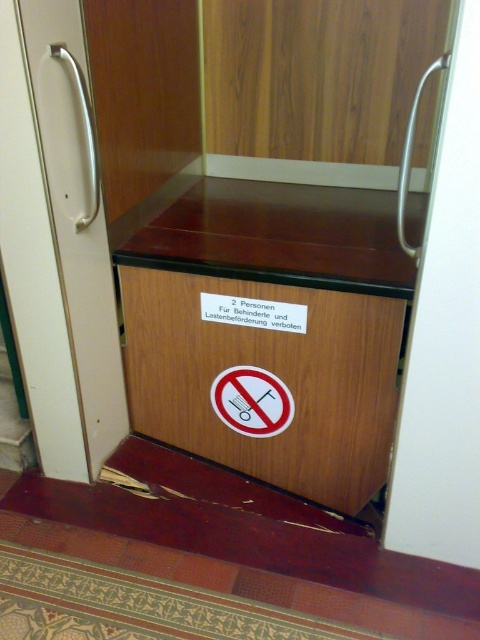
Question: Which point appears closest to the camera in this image?

Choices:
 (A) (349, 476)
 (B) (101, 228)

Answer: (B)

Question: Does wooden drawer at center have a greater width compared to white glossy door handle at left?

Choices:
 (A) yes
 (B) no

Answer: (A)

Question: Is wooden drawer at center behind white glossy door handle at left?

Choices:
 (A) yes
 (B) no

Answer: (A)

Question: Which object appears farthest from the camera in this image?

Choices:
 (A) wooden drawer at center
 (B) white glossy door handle at left

Answer: (A)

Question: Does wooden drawer at center have a smaller size compared to white glossy door handle at left?

Choices:
 (A) no
 (B) yes

Answer: (A)